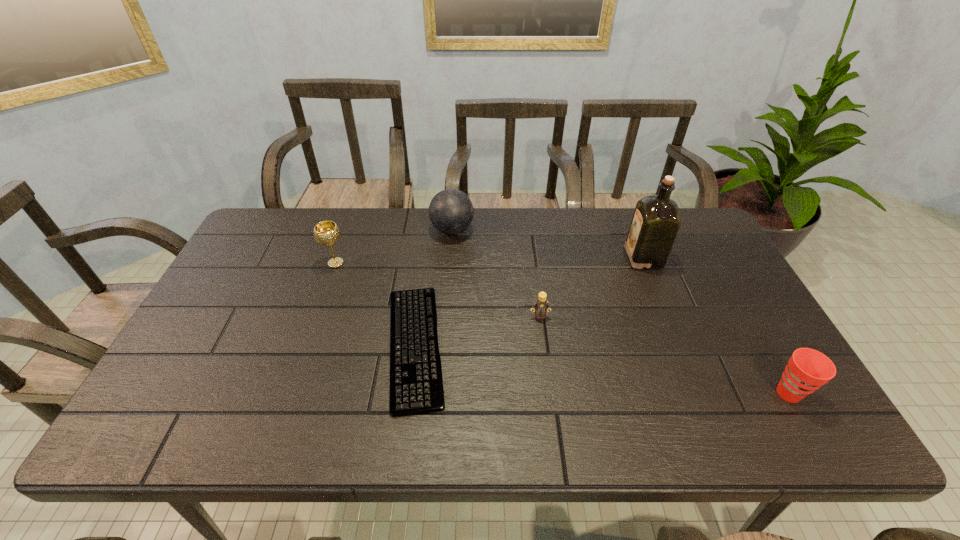
I want to click on object that ranks as the second closest to the shortest object, so click(451, 211).

I want to click on vacant area in the image that satisfies the following two spatial constraints: 1. on the label of the tallest object; 2. in front of the Lego, so click(666, 316).

At what (x,y) coordinates should I click in order to perform the action: click on vacant area in the image that satisfies the following two spatial constraints: 1. in front of the second shortest object; 2. on the right side of the third shortest object. Please return your answer as a coordinate pair (x, y). Looking at the image, I should click on (550, 393).

The width and height of the screenshot is (960, 540). What are the coordinates of `free space in the image that satisfies the following two spatial constraints: 1. on the front side of the cup; 2. on the right side of the leftmost object` in the screenshot? It's located at (290, 393).

Locate an element on the screen. The height and width of the screenshot is (540, 960). free space in the image that satisfies the following two spatial constraints: 1. on the back side of the rightmost object; 2. on the label of the liquor is located at coordinates (711, 258).

Find the location of a particular element. Image resolution: width=960 pixels, height=540 pixels. vacant area that satisfies the following two spatial constraints: 1. on the back side of the rightmost object; 2. on the label of the tallest object is located at coordinates (711, 258).

The width and height of the screenshot is (960, 540). Find the location of `vacant position in the image that satisfies the following two spatial constraints: 1. on the grip area of the bowling ball; 2. on the front side of the chalice`. vacant position in the image that satisfies the following two spatial constraints: 1. on the grip area of the bowling ball; 2. on the front side of the chalice is located at coordinates (450, 263).

The width and height of the screenshot is (960, 540). Find the location of `free space that satisfies the following two spatial constraints: 1. on the grip area of the farthest object; 2. on the back side of the rightmost object`. free space that satisfies the following two spatial constraints: 1. on the grip area of the farthest object; 2. on the back side of the rightmost object is located at coordinates (441, 393).